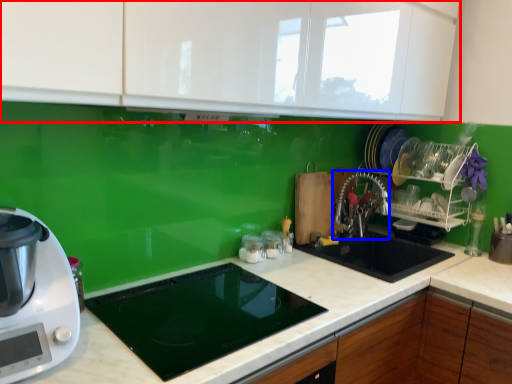
Question: Which of the following is the farthest to the observer, cabinetry (highlighted by a red box) or faucet (highlighted by a blue box)?

Choices:
 (A) cabinetry
 (B) faucet

Answer: (B)